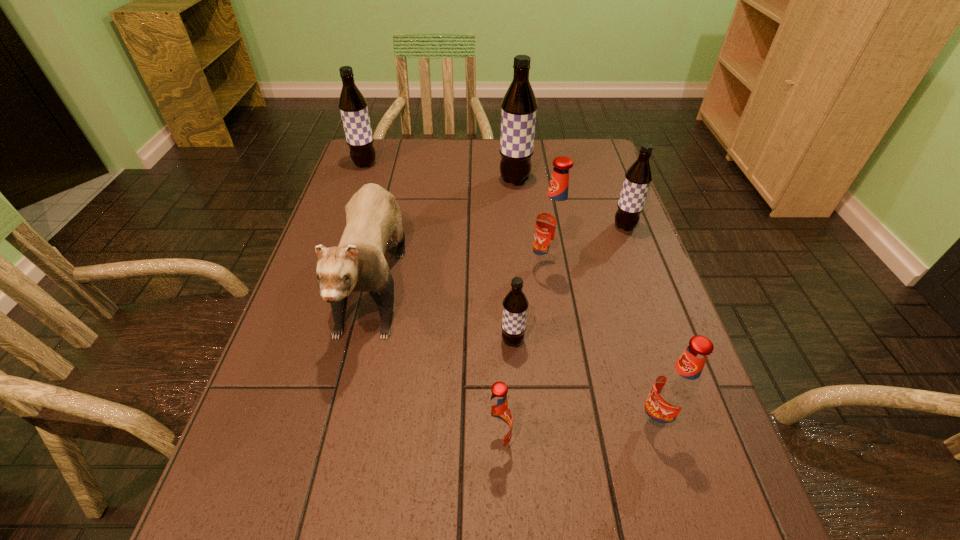
Locate an element on the screen. the second farthest object is located at coordinates (519, 106).

The width and height of the screenshot is (960, 540). What are the coordinates of `the biggest brown root beer` in the screenshot? It's located at (519, 106).

The width and height of the screenshot is (960, 540). I want to click on the leftmost brown root beer, so click(353, 107).

Locate an element on the screen. The height and width of the screenshot is (540, 960). the farthest brown root beer is located at coordinates (353, 107).

Locate an element on the screen. This screenshot has width=960, height=540. the farthest red root beer is located at coordinates (554, 222).

This screenshot has width=960, height=540. In order to click on the biggest red root beer in this screenshot , I will do `click(554, 222)`.

You are a GUI agent. You are given a task and a screenshot of the screen. Output one action in this format:
    pyautogui.click(x=<x>, y=<y>)
    Task: Click on the seventh object from right to left
    This screenshot has height=540, width=960.
    Given the screenshot: What is the action you would take?
    pyautogui.click(x=373, y=216)

I want to click on gray ferret, so click(373, 216).

I want to click on the rightmost root beer, so click(638, 177).

This screenshot has width=960, height=540. What are the coordinates of `the rightmost object` in the screenshot? It's located at (638, 177).